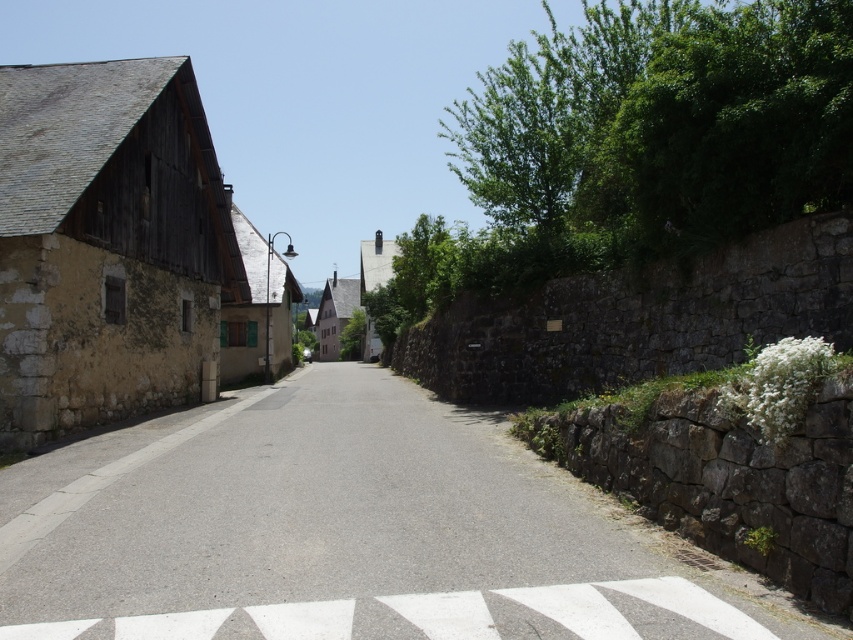
Question: Can you confirm if asphalt road at center is wider than metallic street sign at center?

Choices:
 (A) yes
 (B) no

Answer: (B)

Question: Which of the following is the closest to the observer?

Choices:
 (A) (287, 236)
 (B) (651, 593)
 (C) (62, 497)

Answer: (B)

Question: Can you confirm if asphalt road at center is thinner than metallic street sign at center?

Choices:
 (A) yes
 (B) no

Answer: (A)

Question: Which point is closer to the camera?

Choices:
 (A) (265, 371)
 (B) (273, 621)

Answer: (B)

Question: Which of the following is the closest to the observer?

Choices:
 (A) metallic street sign at center
 (B) white textured road marking at center

Answer: (B)

Question: Where is asphalt road at center located in relation to metallic street sign at center in the image?

Choices:
 (A) below
 (B) above

Answer: (A)